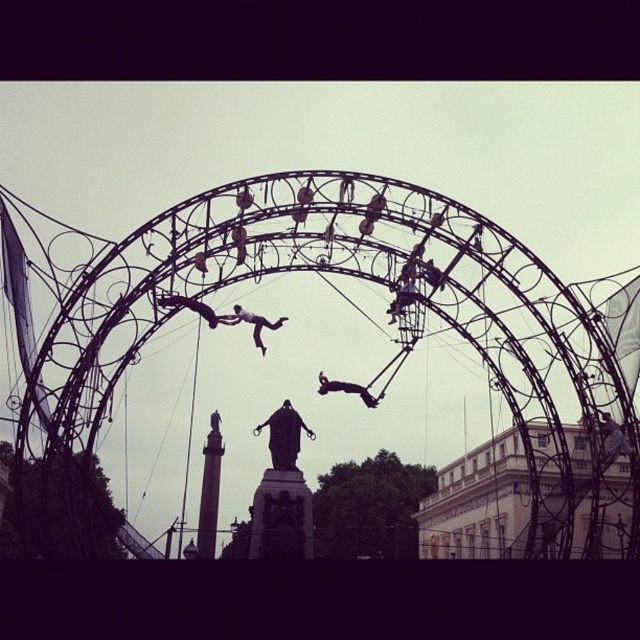
Question: Which of the following is the closest to the observer?

Choices:
 (A) pos(234,321)
 (B) pos(179,275)
 (C) pos(282,419)
 (D) pos(612,436)

Answer: (A)

Question: Can you confirm if black wireframe amusement park at center is bigger than smooth skin figure at center?

Choices:
 (A) yes
 (B) no

Answer: (A)

Question: Which is farther from the polished bronze statue at center?

Choices:
 (A) metallic wire figure at center
 (B) smooth skin figure at center

Answer: (A)

Question: Does black wireframe amusement park at center have a larger size compared to metallic silver statue at center?

Choices:
 (A) yes
 (B) no

Answer: (A)

Question: Can you confirm if metallic silver statue at center is positioned to the right of black matte person at center?

Choices:
 (A) no
 (B) yes

Answer: (B)

Question: Based on their relative distances, which object is nearer to the metallic wire figure at center?

Choices:
 (A) smooth skin figure at center
 (B) metallic silver statue at center

Answer: (A)